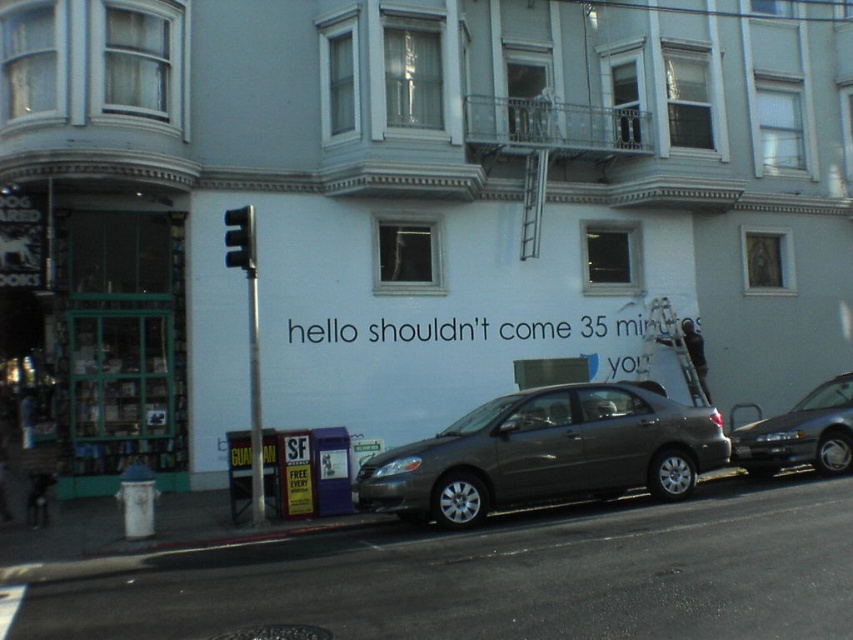
Between point (775, 422) and point (254, 266), which one is positioned in front?

Point (254, 266) is more forward.

You are a GUI agent. You are given a task and a screenshot of the screen. Output one action in this format:
    pyautogui.click(x=<x>, y=<y>)
    Task: Click on the metallic gray sedan at center
    
    Given the screenshot: What is the action you would take?
    pyautogui.click(x=801, y=433)

The width and height of the screenshot is (853, 640). Identify the location of metallic gray sedan at center. (801, 433).

Does satin gray sedan at center lie in front of metallic gray sedan at center?

Yes.

Does satin gray sedan at center have a greater width compared to metallic gray sedan at center?

Yes, satin gray sedan at center is wider than metallic gray sedan at center.

This screenshot has height=640, width=853. Find the location of `satin gray sedan at center`. satin gray sedan at center is located at coordinates (547, 452).

Can you confirm if satin gray sedan at center is taller than black plastic traffic light at upper left?

Indeed, satin gray sedan at center has a greater height compared to black plastic traffic light at upper left.

Locate an element on the screen. This screenshot has height=640, width=853. satin gray sedan at center is located at coordinates (547, 452).